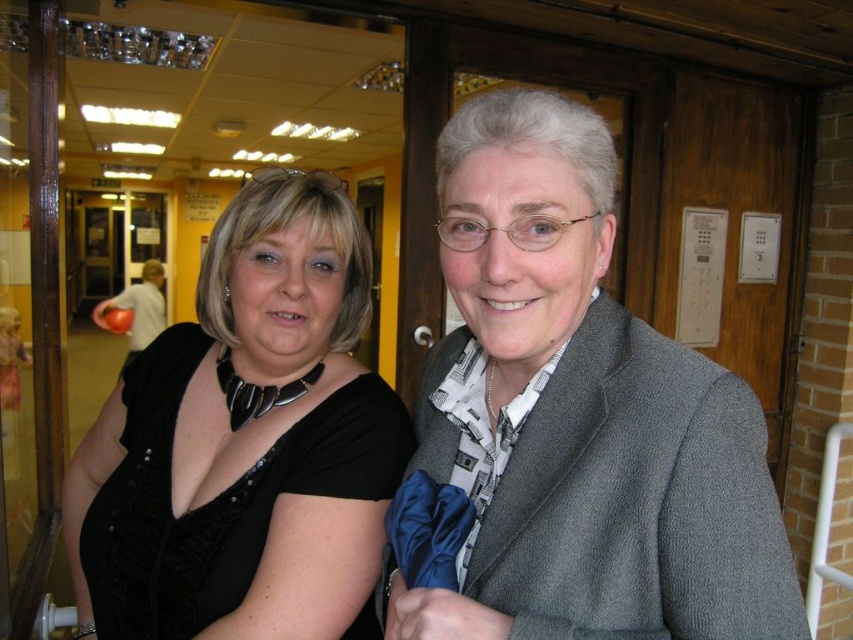
You are standing at the entrance of the building and want to locate the gray woolen jacket at upper right. According to the coordinates provided, in which direction should you move from your current position to reach it?

The gray woolen jacket at upper right is located at point 0.652 on the x axis and 0.680 on the y axis. To reach it, move towards the upper right direction from your current position.

In the scene shown: You are a delivery person who needs to place a small package between the gray woolen jacket at upper right and the black satin dress at left. The package measures 12 inches in length. Will there be enough space between them to fit the package?

The gray woolen jacket at upper right is 11.70 inches away from the black satin dress at left. Since the package measures 12 inches, which is slightly longer than the available space, there won not be enough space to fit the package between them.